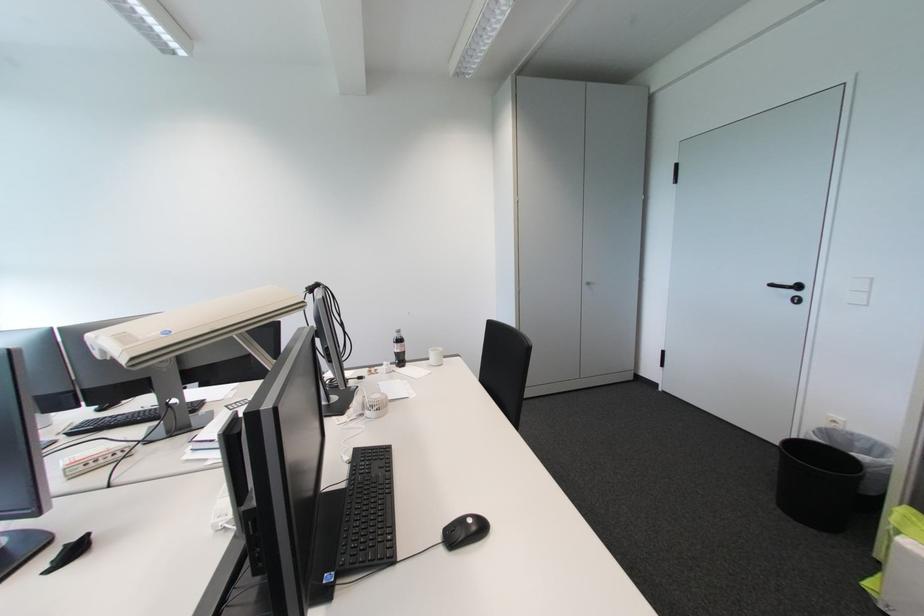
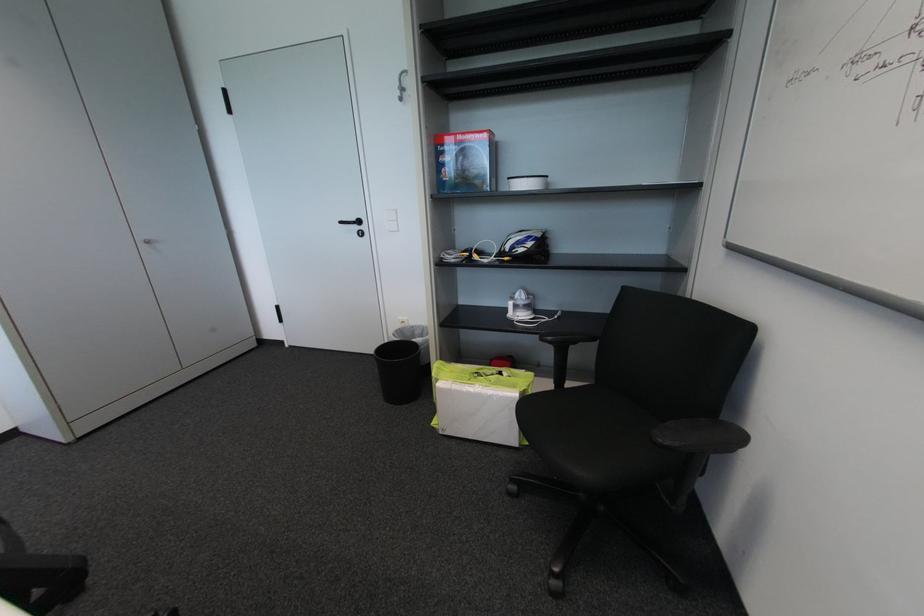
Question: The camera is either moving clockwise (left) or counter-clockwise (right) around the object. The first image is from the beginning of the video and the second image is from the end. Is the camera moving left or right when shooting the video?

Choices:
 (A) Left
 (B) Right

Answer: (A)